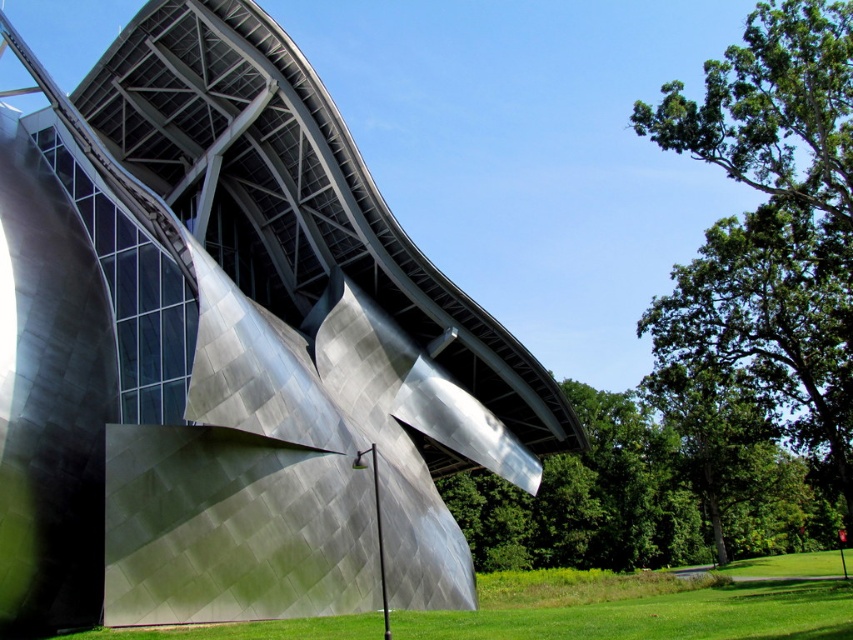
Is metallic silver building at center to the right of green grass at lower center from the viewer's perspective?

No, metallic silver building at center is not to the right of green grass at lower center.

Based on the photo, can you confirm if metallic silver building at center is positioned to the left of green grass at lower center?

Yes, metallic silver building at center is to the left of green grass at lower center.

Which is behind, point (465, 396) or point (838, 573)?

Point (838, 573)

The width and height of the screenshot is (853, 640). I want to click on metallic silver building at center, so click(229, 348).